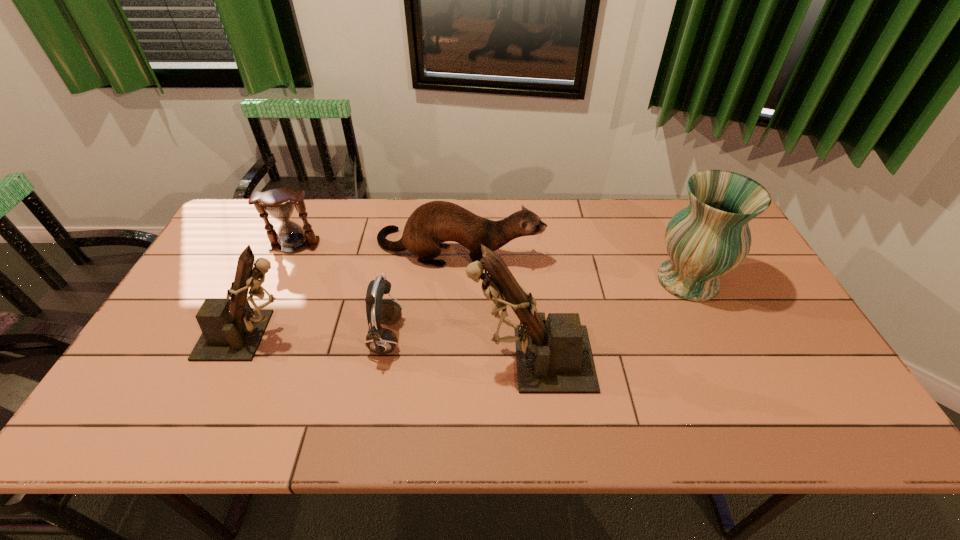
At what (x,y) coordinates should I click in order to perform the action: click on object that is at the right edge. Please return your answer as a coordinate pair (x, y). The height and width of the screenshot is (540, 960). Looking at the image, I should click on click(710, 237).

Where is `free space at the far edge`? This screenshot has height=540, width=960. free space at the far edge is located at coordinates (644, 204).

The image size is (960, 540). What are the coordinates of `free space at the near edge of the desktop` in the screenshot? It's located at (475, 366).

In the image, there is a desktop. Find the location of `vacant space at the near left corner`. vacant space at the near left corner is located at coordinates (146, 383).

This screenshot has height=540, width=960. I want to click on free space that is in between the rightmost object and the ferret, so (x=573, y=265).

Identify the location of free area in between the earphone and the taller figurine. This screenshot has width=960, height=540. (458, 348).

Identify the location of blank region between the ferret and the shorter figurine. (355, 292).

Where is `vacant area between the rightmost object and the shorter figurine`? Image resolution: width=960 pixels, height=540 pixels. vacant area between the rightmost object and the shorter figurine is located at coordinates (470, 308).

The height and width of the screenshot is (540, 960). I want to click on free space that is in between the earphone and the taller figurine, so click(458, 348).

Locate an element on the screen. blank region between the earphone and the taller figurine is located at coordinates (458, 348).